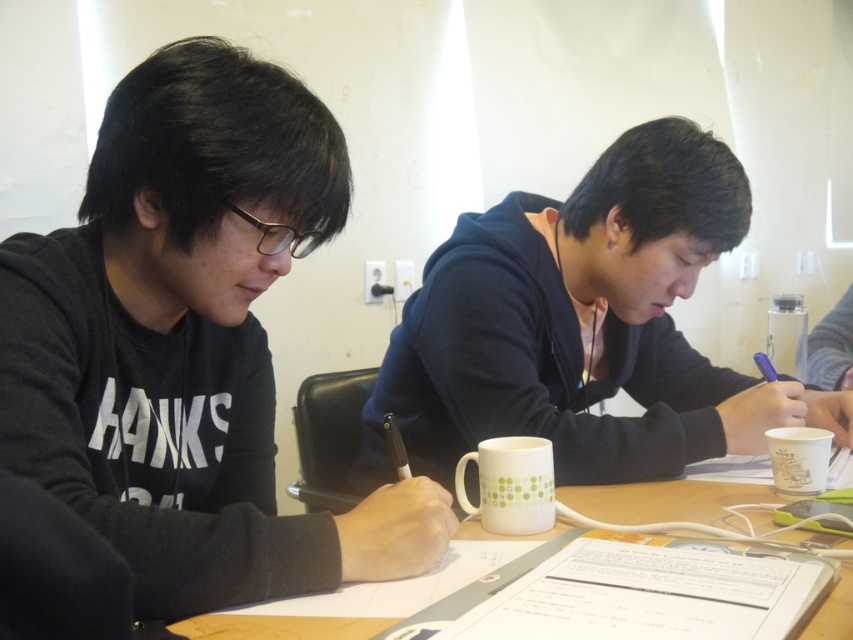
You are organizing a meeting and need to place a name tag on the table. The name tag is 3 cm tall. Which object, the white paper at center or the white paper cup at lower right, can accommodate the name tag without covering its main content?

The white paper cup at lower right has a greater height than the white paper at center. Since the name tag is 3 cm tall, it can be placed on the white paper cup at lower right as it has enough vertical space to accommodate the name tag without covering its main content.

You are a delivery robot with a 10 inch wide package. You need to place it between the black matte hoodie at left and the other person. Is there enough space?

The black matte hoodie at left and the other person are 23.42 inches apart. Since the package is 10 inches wide, there is sufficient space to place it between them.